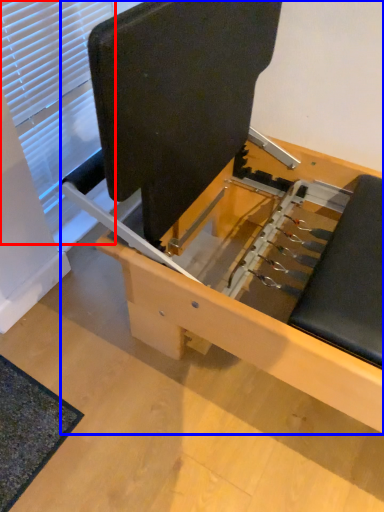
Question: Which object appears farthest to the camera in this image, window (highlighted by a red box) or furniture (highlighted by a blue box)?

Choices:
 (A) window
 (B) furniture

Answer: (A)